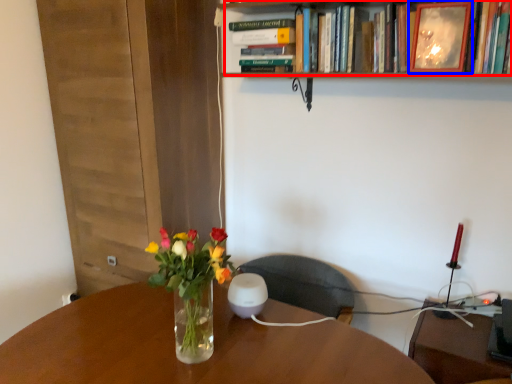
Question: Which object appears farthest to the camera in this image, book (highlighted by a red box) or picture frame (highlighted by a blue box)?

Choices:
 (A) book
 (B) picture frame

Answer: (B)